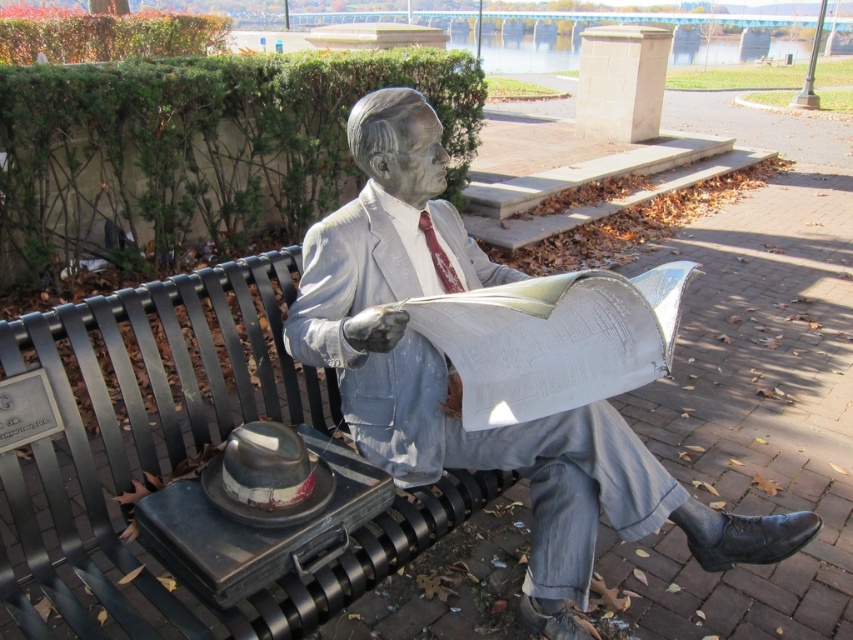
You are an artist who wants to sketch the scene. You need to know the relative positions of the gray stone statue at center and the shiny metallic hat at lower left. Which object is positioned to the right of the other?

The gray stone statue at center is positioned to the right of the shiny metallic hat at lower left.

You are a sculptor who wants to create a miniature version of the scene. You need to know the relative sizes of the gray stone statue at center and the shiny metallic hat at lower left to scale them correctly. Which object is bigger?

The gray stone statue at center has a larger size compared to the shiny metallic hat at lower left, so the statue should be scaled down more than the hat to maintain their size relationship in the miniature version.

You are standing in a public area and want to place a small decorative item exactly 6 feet away from your current position. There is a point marked at coordinates point (x=328, y=296) in the scene. Can you use this point to determine if placing the item at that location would meet the requirement?

The distance between point (x=328, y=296) and the viewer is 5.68 feet. Since 5.68 feet is less than 6 feet, placing the item at point 0.463, 0.463 would not meet the requirement of being exactly 6 feet away.